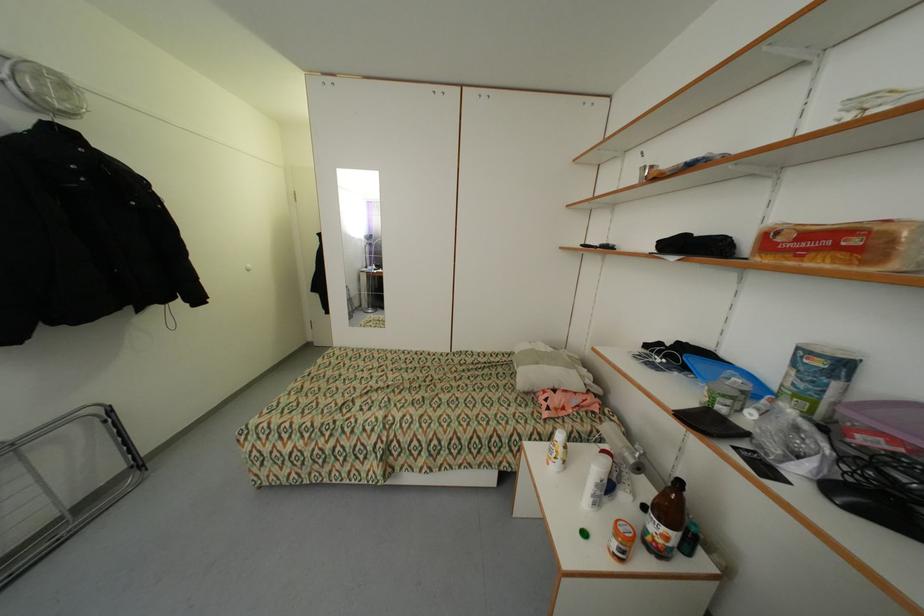
This screenshot has width=924, height=616. Find the location of `white spray bottle`. white spray bottle is located at coordinates (597, 479).